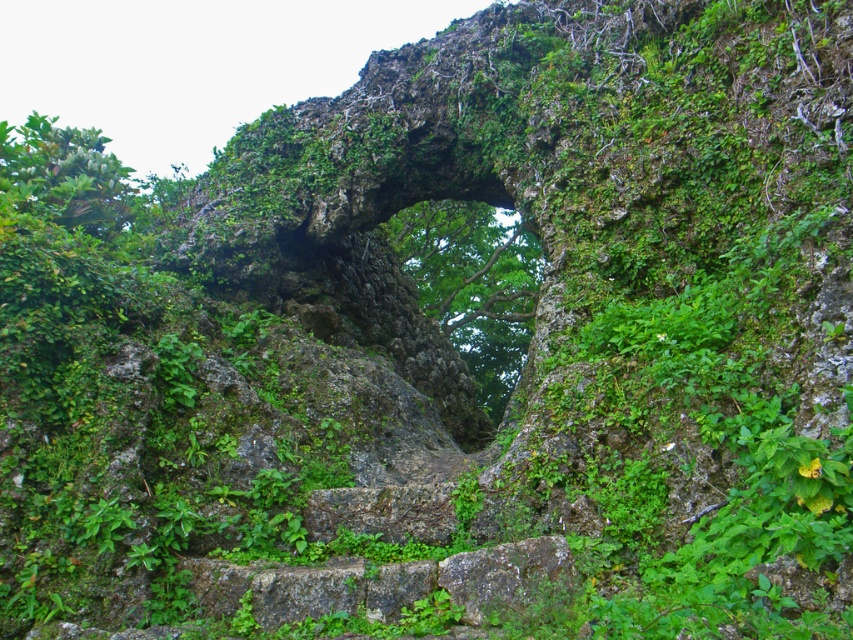
You are standing at the base of the rock formation and want to take a photo of the archway. To ensure both the green leafy tree at center and the green leafy tree at upper left are fully visible in your photo, which tree should you position closer to the camera?

You should position the green leafy tree at center closer to the camera because the green leafy tree at upper left is behind it, so moving the center tree forward will keep both visible without one blocking the other.

Based on the photo, you are a hiker who wants to take a photo of the green leafy tree at center and the green leafy tree at upper left. Which tree should you move closer to in order to capture both trees in the same frame without zooming in?

You should move closer to the green leafy tree at center because it occupies less space than the green leafy tree at upper left, allowing both to fit in the frame when positioned closer to the smaller tree.

You are a hiker who wants to take a photo of both the green leafy tree at center and the green leafy tree at upper left in the same frame. Given that your camera has a maximum zoom range of 5 meters, can you capture both trees in a single photo without moving your position?

The green leafy tree at center is 7.38 meters away from the green leafy tree at upper left. Since your camera can only zoom up to 5 meters, you won not be able to capture both trees in the same frame without moving your position.